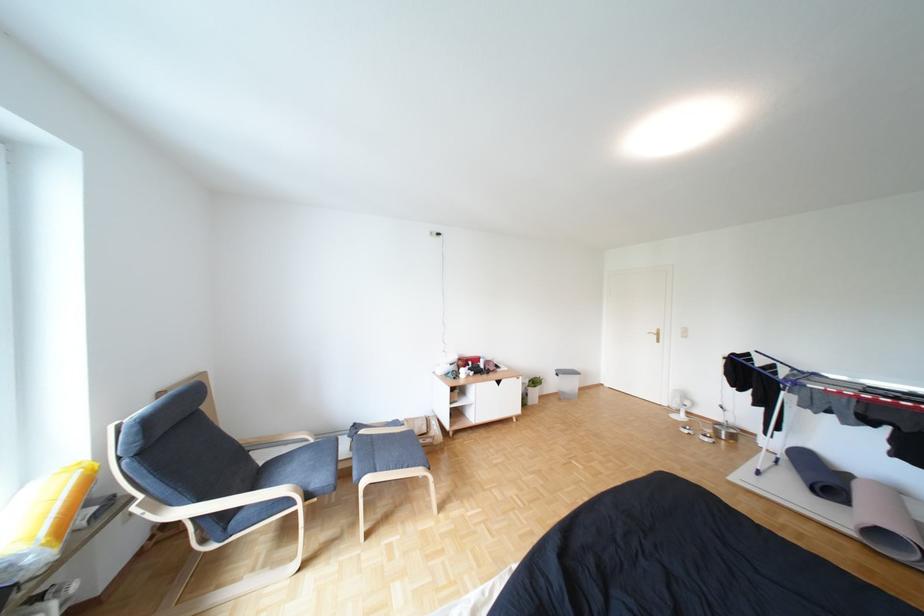
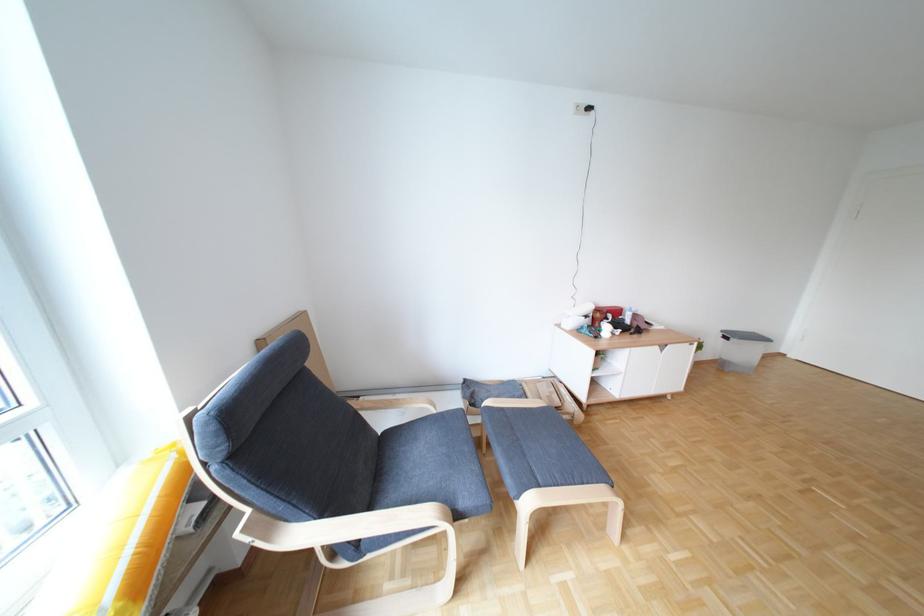
Find the pixel in the second image that matches pixel 515 382 in the first image.

(678, 347)